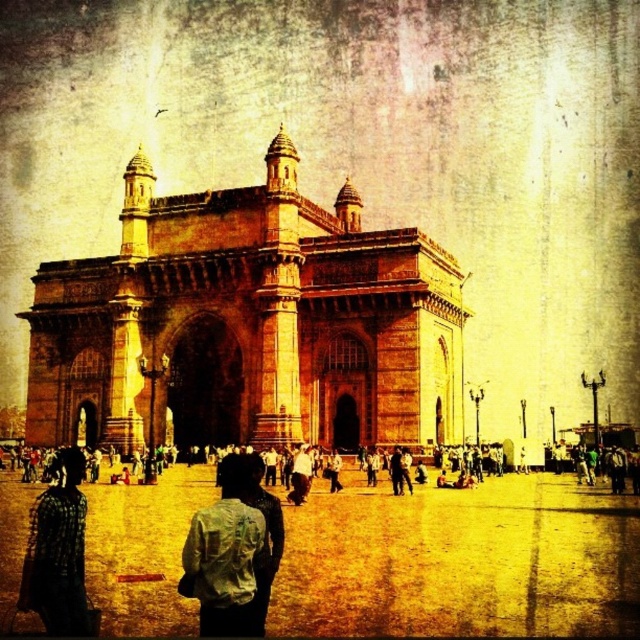
Question: Does brown stone gateway of india at center come behind checkered fabric shirt at lower left?

Choices:
 (A) yes
 (B) no

Answer: (A)

Question: Which object appears closest to the camera in this image?

Choices:
 (A) white cotton shirt at center
 (B) checkered fabric shirt at lower left
 (C) brown stone gateway of india at center
 (D) light blue fabric shirt at center

Answer: (D)

Question: Can you confirm if brown stone gateway of india at center is bigger than white cotton shirt at center?

Choices:
 (A) yes
 (B) no

Answer: (A)

Question: Which is farther from the light blue fabric shirt at center?

Choices:
 (A) brown stone gateway of india at center
 (B) checkered fabric shirt at lower left

Answer: (A)

Question: Does brown stone gateway of india at center have a larger size compared to checkered fabric shirt at lower left?

Choices:
 (A) yes
 (B) no

Answer: (A)

Question: Estimate the real-world distances between objects in this image. Which object is farther from the brown stone gateway of india at center?

Choices:
 (A) checkered fabric shirt at lower left
 (B) light blue fabric shirt at center

Answer: (A)